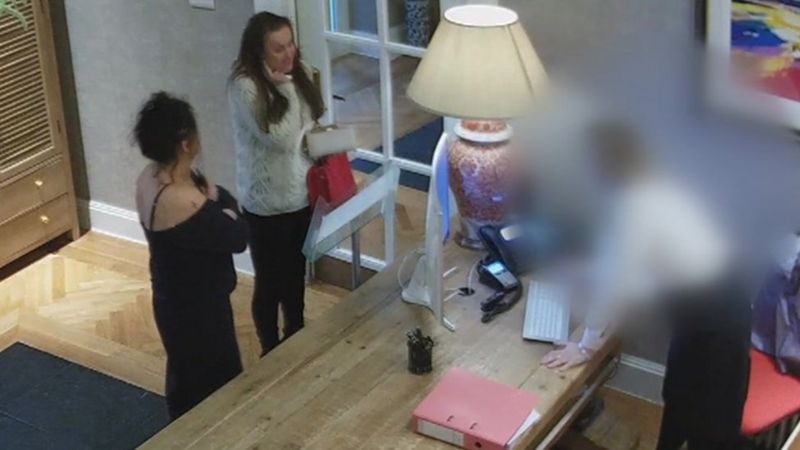
This screenshot has height=450, width=800. In order to click on wood floor in this screenshot , I will do `click(93, 303)`.